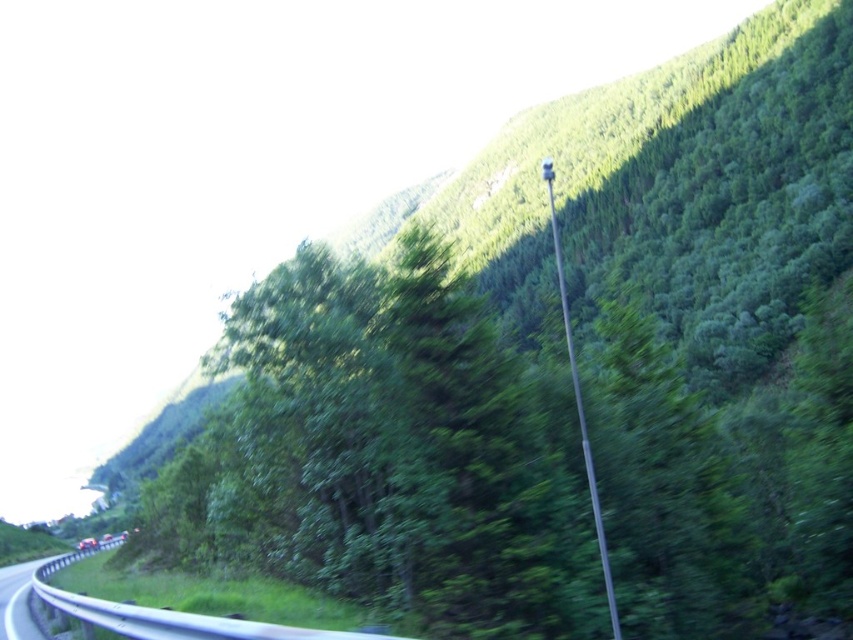
Question: Can you confirm if green leafy hillside at upper center is bigger than metallic gray highway at lower left?

Choices:
 (A) no
 (B) yes

Answer: (B)

Question: Which of the following is the farthest from the observer?

Choices:
 (A) green leafy hillside at upper center
 (B) silver metallic pole at center-right
 (C) metallic gray highway at lower left

Answer: (A)

Question: Does silver metallic pole at center-right appear under metallic gray highway at lower left?

Choices:
 (A) no
 (B) yes

Answer: (A)

Question: Which point appears farthest from the camera in this image?

Choices:
 (A) [x=0, y=620]
 (B) [x=502, y=205]

Answer: (B)

Question: Which object appears closest to the camera in this image?

Choices:
 (A) green leafy hillside at upper center
 (B) silver metallic pole at center-right
 (C) metallic gray highway at lower left

Answer: (B)

Question: Does green leafy hillside at upper center appear on the left side of silver metallic pole at center-right?

Choices:
 (A) no
 (B) yes

Answer: (B)